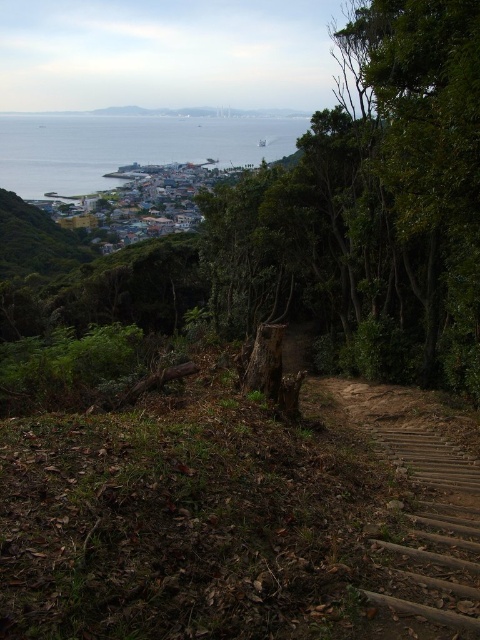
Does green rough bark tree at center appear on the right side of wooden stairs at lower right?

Correct, you'll find green rough bark tree at center to the right of wooden stairs at lower right.

Between green rough bark tree at center and wooden stairs at lower right, which one is positioned higher?

green rough bark tree at center

The height and width of the screenshot is (640, 480). I want to click on green rough bark tree at center, so click(377, 200).

The width and height of the screenshot is (480, 640). What are the coordinates of `green rough bark tree at center` in the screenshot? It's located at (377, 200).

Can you confirm if blue water at center is wider than wooden stairs at lower right?

Correct, the width of blue water at center exceeds that of wooden stairs at lower right.

Who is more forward, (80, 145) or (394, 458)?

Point (394, 458)

Where is `blue water at center`? Image resolution: width=480 pixels, height=640 pixels. blue water at center is located at coordinates (128, 147).

Who is taller, green rough bark tree at center or blue water at center?

With more height is blue water at center.

You are a GUI agent. You are given a task and a screenshot of the screen. Output one action in this format:
    pyautogui.click(x=<x>, y=<y>)
    Task: Click on the green rough bark tree at center
    The width and height of the screenshot is (480, 640).
    Given the screenshot: What is the action you would take?
    tap(377, 200)